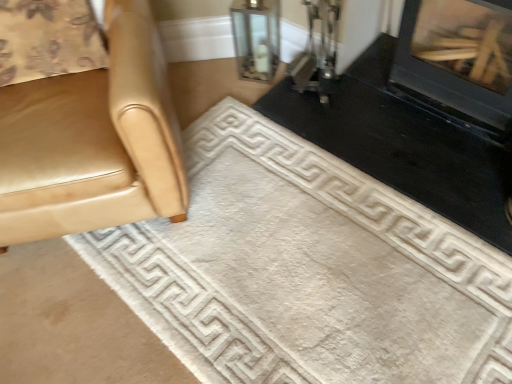
The width and height of the screenshot is (512, 384). What do you see at coordinates (425, 113) in the screenshot?
I see `black glossy fireplace at upper right, marked as the 1th fireplace in a left-to-right arrangement` at bounding box center [425, 113].

You are a GUI agent. You are given a task and a screenshot of the screen. Output one action in this format:
    pyautogui.click(x=<x>, y=<y>)
    Task: Click on the black glossy fireplace at upper right, the 2th fireplace in the right-to-left sequence
    
    Given the screenshot: What is the action you would take?
    pyautogui.click(x=425, y=113)

You are a GUI agent. You are given a task and a screenshot of the screen. Output one action in this format:
    pyautogui.click(x=<x>, y=<y>)
    Task: Click on the matte gold chair at left
    Image resolution: width=512 pixels, height=384 pixels.
    Given the screenshot: What is the action you would take?
    pyautogui.click(x=93, y=141)

Which object is positioned more to the right, white soft rug at center or black glossy fireplace at upper right, the 2th fireplace in the right-to-left sequence?

From the viewer's perspective, black glossy fireplace at upper right, the 2th fireplace in the right-to-left sequence, appears more on the right side.

Based on their sizes in the image, would you say white soft rug at center is bigger or smaller than black glossy fireplace at upper right, marked as the 1th fireplace in a left-to-right arrangement?

In the image, white soft rug at center appears to be larger than black glossy fireplace at upper right, marked as the 1th fireplace in a left-to-right arrangement.

Between white soft rug at center and black glossy fireplace at upper right, marked as the 1th fireplace in a left-to-right arrangement, which one has more height?

With more height is white soft rug at center.

Measure the distance between white soft rug at center and black glossy fireplace at upper right, the 2th fireplace in the right-to-left sequence.

A distance of 15.47 inches exists between white soft rug at center and black glossy fireplace at upper right, the 2th fireplace in the right-to-left sequence.

Can you confirm if black glass fireplace at upper right, the second fireplace positioned from the left, is shorter than matte gold chair at left?

Yes.

Measure the distance between black glass fireplace at upper right, the first fireplace from the right, and matte gold chair at left.

The distance of black glass fireplace at upper right, the first fireplace from the right, from matte gold chair at left is 1.10 meters.

Is point (408, 70) more distant than point (182, 192)?

That is True.

Is black glass fireplace at upper right, the second fireplace positioned from the left, with matte gold chair at left?

No, black glass fireplace at upper right, the second fireplace positioned from the left, is not touching matte gold chair at left.

Can you confirm if clear glass vase at upper center is smaller than black glass fireplace at upper right, the first fireplace from the right?

Yes.

From a real-world perspective, who is located higher, clear glass vase at upper center or black glass fireplace at upper right, the second fireplace positioned from the left?

In real-world perspective, black glass fireplace at upper right, the second fireplace positioned from the left, is above.

Based on the photo, who is shorter, clear glass vase at upper center or black glass fireplace at upper right, the second fireplace positioned from the left?

clear glass vase at upper center is shorter.

Between clear glass vase at upper center and black glass fireplace at upper right, the first fireplace from the right, which one appears on the left side from the viewer's perspective?

Positioned to the left is clear glass vase at upper center.

Does black glossy fireplace at upper right, marked as the 1th fireplace in a left-to-right arrangement, have a lesser width compared to clear glass vase at upper center?

In fact, black glossy fireplace at upper right, marked as the 1th fireplace in a left-to-right arrangement, might be wider than clear glass vase at upper center.

Is black glossy fireplace at upper right, the 2th fireplace in the right-to-left sequence, turned away from clear glass vase at upper center?

That's not correct — black glossy fireplace at upper right, the 2th fireplace in the right-to-left sequence, is not looking away from clear glass vase at upper center.

Which object is positioned more to the right, black glossy fireplace at upper right, the 2th fireplace in the right-to-left sequence, or clear glass vase at upper center?

black glossy fireplace at upper right, the 2th fireplace in the right-to-left sequence, is more to the right.

Considering the relative sizes of white soft rug at center and matte gold chair at left in the image provided, is white soft rug at center taller than matte gold chair at left?

No.

Is white soft rug at center looking in the opposite direction of matte gold chair at left?

No, white soft rug at center is not facing away from matte gold chair at left.

Between white soft rug at center and matte gold chair at left, which one is positioned in front?

matte gold chair at left.

I want to click on doormat on the right of the matte gold chair at left, so click(307, 270).

Looking at this image, is black glass fireplace at upper right, the first fireplace from the right, looking in the opposite direction of black glossy fireplace at upper right, the 2th fireplace in the right-to-left sequence?

No, black glass fireplace at upper right, the first fireplace from the right, is not facing the opposite direction of black glossy fireplace at upper right, the 2th fireplace in the right-to-left sequence.

Which is closer to the camera, (426, 54) or (279, 119)?

Point (426, 54) appears to be closer to the viewer than point (279, 119).

Where is `fireplace that appears on the right of black glossy fireplace at upper right, the 2th fireplace in the right-to-left sequence`? fireplace that appears on the right of black glossy fireplace at upper right, the 2th fireplace in the right-to-left sequence is located at coordinates (459, 57).

What's the angular difference between white soft rug at center and clear glass vase at upper center's facing directions?

white soft rug at center and clear glass vase at upper center are facing 47.1 degrees away from each other.

Which is in front, point (206, 208) or point (250, 48)?

The point (206, 208) is in front.

Based on the photo, in the image, is white soft rug at center positioned in front of or behind clear glass vase at upper center?

Visually, white soft rug at center is located in front of clear glass vase at upper center.

From the image's perspective, who appears lower, white soft rug at center or clear glass vase at upper center?

From the image's view, white soft rug at center is below.

Where is `doormat in front of the black glossy fireplace at upper right, the 2th fireplace in the right-to-left sequence`? This screenshot has width=512, height=384. doormat in front of the black glossy fireplace at upper right, the 2th fireplace in the right-to-left sequence is located at coordinates (307, 270).

The height and width of the screenshot is (384, 512). Find the location of `chair on the left of black glass fireplace at upper right, the second fireplace positioned from the left`. chair on the left of black glass fireplace at upper right, the second fireplace positioned from the left is located at coordinates (93, 141).

Based on their spatial positions, is white soft rug at center or black glossy fireplace at upper right, marked as the 1th fireplace in a left-to-right arrangement, closer to clear glass vase at upper center?

black glossy fireplace at upper right, marked as the 1th fireplace in a left-to-right arrangement.

Considering their positions, is black glass fireplace at upper right, the second fireplace positioned from the left, positioned further to matte gold chair at left than white soft rug at center?

black glass fireplace at upper right, the second fireplace positioned from the left, lies further to matte gold chair at left than the other object.

Based on their spatial positions, is black glossy fireplace at upper right, marked as the 1th fireplace in a left-to-right arrangement, or white soft rug at center closer to clear glass vase at upper center?

black glossy fireplace at upper right, marked as the 1th fireplace in a left-to-right arrangement, is positioned closer to the anchor clear glass vase at upper center.

Considering their positions, is clear glass vase at upper center positioned closer to black glossy fireplace at upper right, marked as the 1th fireplace in a left-to-right arrangement, than matte gold chair at left?

clear glass vase at upper center lies closer to black glossy fireplace at upper right, marked as the 1th fireplace in a left-to-right arrangement, than the other object.

Looking at this image, based on their spatial positions, is white soft rug at center or black glass fireplace at upper right, the second fireplace positioned from the left, further from black glossy fireplace at upper right, the 2th fireplace in the right-to-left sequence?

Based on the image, white soft rug at center appears to be further to black glossy fireplace at upper right, the 2th fireplace in the right-to-left sequence.

Looking at the image, which one is located closer to white soft rug at center, clear glass vase at upper center or matte gold chair at left?

Based on the image, matte gold chair at left appears to be nearer to white soft rug at center.

Considering their positions, is clear glass vase at upper center positioned closer to matte gold chair at left than black glass fireplace at upper right, the first fireplace from the right?

clear glass vase at upper center lies closer to matte gold chair at left than the other object.

When comparing their distances from clear glass vase at upper center, does matte gold chair at left or white soft rug at center seem closer?

white soft rug at center.

Identify the location of fireplace between black glass fireplace at upper right, the first fireplace from the right, and white soft rug at center in the up-down direction. Image resolution: width=512 pixels, height=384 pixels. (425, 113).

Locate an element on the screen. The height and width of the screenshot is (384, 512). doormat between matte gold chair at left and black glass fireplace at upper right, the second fireplace positioned from the left is located at coordinates (307, 270).

You are a GUI agent. You are given a task and a screenshot of the screen. Output one action in this format:
    pyautogui.click(x=<x>, y=<y>)
    Task: Click on the fireplace between clear glass vase at upper center and black glass fireplace at upper right, the second fireplace positioned from the left, from left to right
    The height and width of the screenshot is (384, 512).
    Given the screenshot: What is the action you would take?
    pyautogui.click(x=425, y=113)

The width and height of the screenshot is (512, 384). Find the location of `chair between clear glass vase at upper center and white soft rug at center from top to bottom`. chair between clear glass vase at upper center and white soft rug at center from top to bottom is located at coordinates (93, 141).